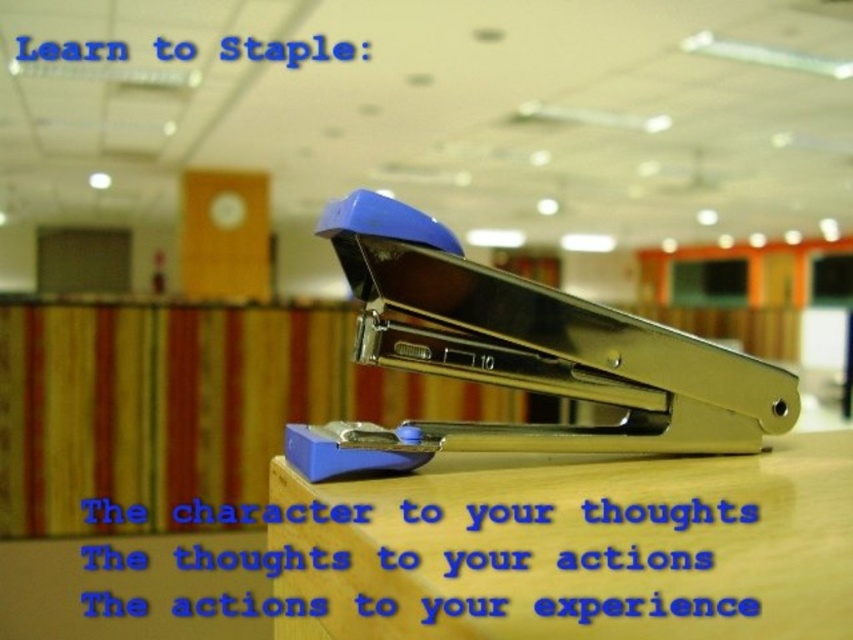
Question: Which point is farther to the camera?

Choices:
 (A) (611, 577)
 (B) (698, 417)

Answer: (B)

Question: Which object appears closest to the camera in this image?

Choices:
 (A) wooden table at center
 (B) blue metallic stapler at center

Answer: (A)

Question: Is wooden table at center to the left of blue metallic stapler at center from the viewer's perspective?

Choices:
 (A) yes
 (B) no

Answer: (B)

Question: Does wooden table at center lie in front of blue metallic stapler at center?

Choices:
 (A) no
 (B) yes

Answer: (B)

Question: Does wooden table at center come in front of blue metallic stapler at center?

Choices:
 (A) yes
 (B) no

Answer: (A)